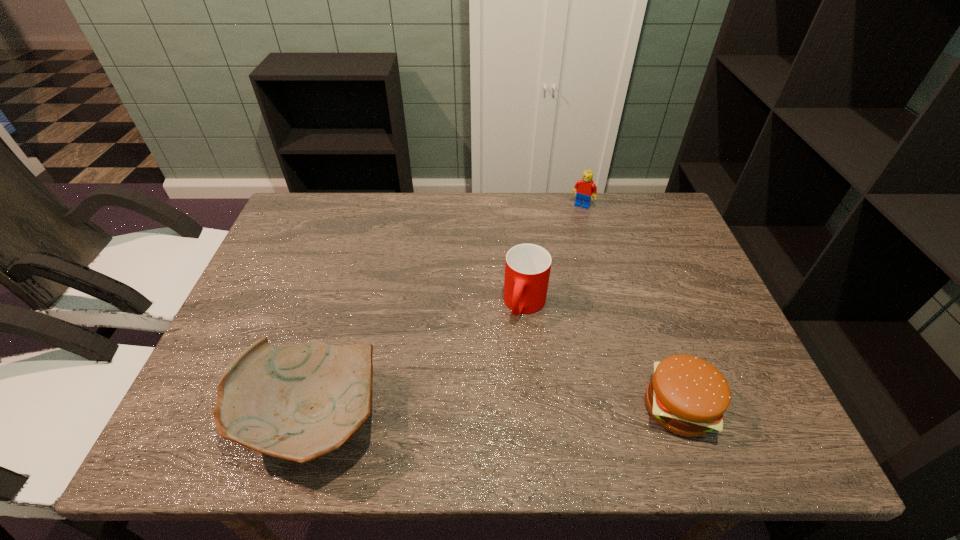
Where is `vacant spot on the desktop that is between the pottery and the shortest object and is positioned on the side of the second object from left to right with the handle`? The height and width of the screenshot is (540, 960). vacant spot on the desktop that is between the pottery and the shortest object and is positioned on the side of the second object from left to right with the handle is located at coordinates (478, 413).

Find the location of a particular element. The image size is (960, 540). vacant space on the desktop that is between the leftmost object and the shortest object and is positioned on the face of the Lego is located at coordinates (465, 414).